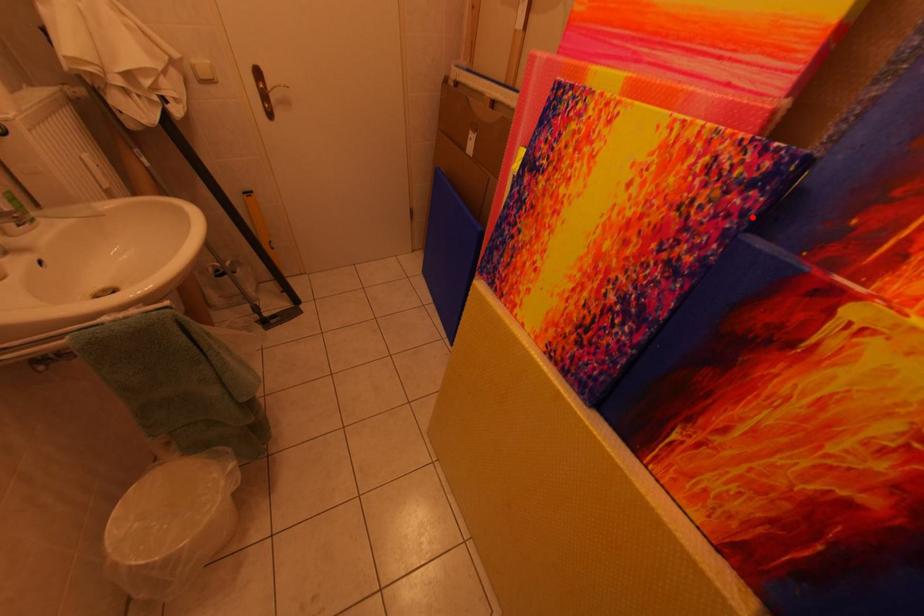
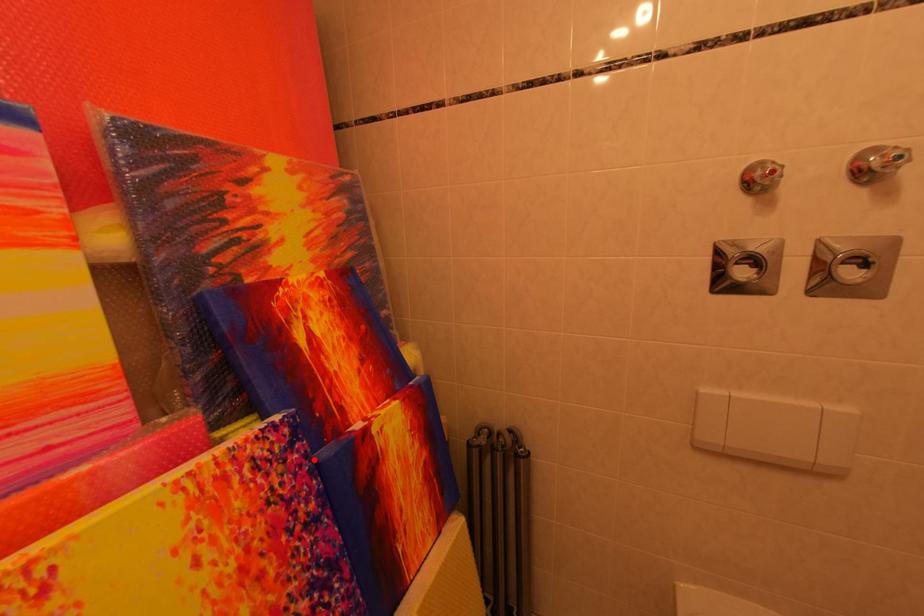
I am providing you with two images of the same scene from different viewpoints. A red point is marked on the first image and another point is marked on the second image. Does the point marked in image1 correspond to the same location as the one in image2?

Yes